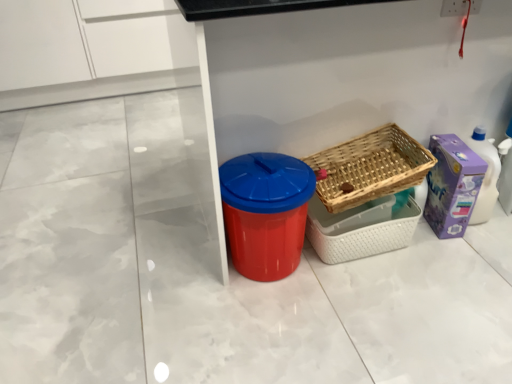
What do you see at coordinates (452, 185) in the screenshot? I see `purple cardboard box at right` at bounding box center [452, 185].

The image size is (512, 384). Describe the element at coordinates (265, 212) in the screenshot. I see `red plastic bin at center` at that location.

The width and height of the screenshot is (512, 384). What do you see at coordinates (369, 167) in the screenshot? I see `woven wood basket at center right, which appears as the 2th basket when ordered from the bottom` at bounding box center [369, 167].

What are the coordinates of `purple cardboard box at right` in the screenshot? It's located at (452, 185).

From a real-world perspective, between red plastic bin at center and purple cardboard box at right, who is vertically lower?

purple cardboard box at right, from a real-world perspective.

Which point is more distant from viewer, (305, 223) or (448, 181)?

The point (448, 181) is farther.

Can you confirm if red plastic bin at center is wider than purple cardboard box at right?

Correct, the width of red plastic bin at center exceeds that of purple cardboard box at right.

Considering the positions of objects red plastic bin at center and purple cardboard box at right in the image provided, who is in front, red plastic bin at center or purple cardboard box at right?

red plastic bin at center is closer to the camera.

Is woven wood basket at center right, which appears as the first basket when ordered from the bottom, wider or thinner than red plastic bin at center?

In the image, woven wood basket at center right, which appears as the first basket when ordered from the bottom, appears to be more narrow than red plastic bin at center.

Considering the relative sizes of woven wood basket at center right, which appears as the first basket when ordered from the bottom, and red plastic bin at center in the image provided, is woven wood basket at center right, which appears as the first basket when ordered from the bottom, taller than red plastic bin at center?

No.

Would you say woven wood basket at center right, which appears as the first basket when ordered from the bottom, is outside red plastic bin at center?

Yes.

From the picture: Is woven wood basket at center right, which appears as the first basket when ordered from the bottom, in front of or behind red plastic bin at center in the image?

In the image, woven wood basket at center right, which appears as the first basket when ordered from the bottom, appears behind red plastic bin at center.

Is woven wood basket at center right, which appears as the first basket when ordered from the bottom, completely or partially inside purple cardboard box at right?

No, woven wood basket at center right, which appears as the first basket when ordered from the bottom, is located outside of purple cardboard box at right.

Are purple cardboard box at right and woven wood basket at center right, marked as the second basket in a top-to-bottom arrangement, located far from each other?

purple cardboard box at right is actually quite close to woven wood basket at center right, marked as the second basket in a top-to-bottom arrangement.

Is purple cardboard box at right turned away from woven wood basket at center right, marked as the second basket in a top-to-bottom arrangement?

No, purple cardboard box at right is not facing away from woven wood basket at center right, marked as the second basket in a top-to-bottom arrangement.

Looking at this image, which of these two, purple cardboard box at right or woven wood basket at center right, which appears as the first basket when ordered from the bottom, is bigger?

woven wood basket at center right, which appears as the first basket when ordered from the bottom, is bigger.

Which object is thinner, purple cardboard box at right or woven wood basket at center right, the first basket in the top-to-bottom sequence?

purple cardboard box at right.

From the image's perspective, is purple cardboard box at right above or below woven wood basket at center right, which appears as the 2th basket when ordered from the bottom?

Clearly, from the image's perspective, purple cardboard box at right is below woven wood basket at center right, which appears as the 2th basket when ordered from the bottom.

Is purple cardboard box at right oriented away from woven wood basket at center right, which appears as the 2th basket when ordered from the bottom?

No, purple cardboard box at right is not facing the opposite direction of woven wood basket at center right, which appears as the 2th basket when ordered from the bottom.

Would you say purple cardboard box at right is inside or outside woven wood basket at center right, which appears as the 2th basket when ordered from the bottom?

purple cardboard box at right lies outside woven wood basket at center right, which appears as the 2th basket when ordered from the bottom.

How distant is woven wood basket at center right, which appears as the 2th basket when ordered from the bottom, from purple cardboard box at right?

woven wood basket at center right, which appears as the 2th basket when ordered from the bottom, and purple cardboard box at right are 8.38 inches apart.

Does woven wood basket at center right, which appears as the 2th basket when ordered from the bottom, appear on the left side of purple cardboard box at right?

Yes, woven wood basket at center right, which appears as the 2th basket when ordered from the bottom, is to the left of purple cardboard box at right.

Can you confirm if woven wood basket at center right, the first basket in the top-to-bottom sequence, is taller than purple cardboard box at right?

No.

From a real-world perspective, is woven wood basket at center right, the first basket in the top-to-bottom sequence, located beneath purple cardboard box at right?

Actually, woven wood basket at center right, the first basket in the top-to-bottom sequence, is physically above purple cardboard box at right in the real world.

Which object is further away from the camera taking this photo, purple cardboard box at right or red plastic bin at center?

purple cardboard box at right is more distant.

Looking at this image, can you confirm if purple cardboard box at right is shorter than red plastic bin at center?

Correct, purple cardboard box at right is not as tall as red plastic bin at center.

Which is closer to the camera, (444, 228) or (252, 211)?

Positioned in front is point (252, 211).

Between woven wood basket at center right, the first basket in the top-to-bottom sequence, and woven wood basket at center right, which appears as the first basket when ordered from the bottom, which one appears on the left side from the viewer's perspective?

From the viewer's perspective, woven wood basket at center right, the first basket in the top-to-bottom sequence, appears more on the left side.

From the image's perspective, is woven wood basket at center right, which appears as the 2th basket when ordered from the bottom, above woven wood basket at center right, which appears as the first basket when ordered from the bottom?

Correct, woven wood basket at center right, which appears as the 2th basket when ordered from the bottom, appears higher than woven wood basket at center right, which appears as the first basket when ordered from the bottom, in the image.

Identify the location of basket in front of the woven wood basket at center right, marked as the second basket in a top-to-bottom arrangement. (369, 167).

Where is `storage box below the red plastic bin at center (from a real-world perspective)`? storage box below the red plastic bin at center (from a real-world perspective) is located at coordinates (452, 185).

Find the location of a particular element. The width and height of the screenshot is (512, 384). waste container in front of the woven wood basket at center right, which appears as the first basket when ordered from the bottom is located at coordinates (265, 212).

When comparing their distances from woven wood basket at center right, which appears as the 2th basket when ordered from the bottom, does red plastic bin at center or purple cardboard box at right seem further?

red plastic bin at center is positioned further to the anchor woven wood basket at center right, which appears as the 2th basket when ordered from the bottom.

From the image, which object appears to be farther from purple cardboard box at right, woven wood basket at center right, the first basket in the top-to-bottom sequence, or woven wood basket at center right, marked as the second basket in a top-to-bottom arrangement?

woven wood basket at center right, marked as the second basket in a top-to-bottom arrangement, is further to purple cardboard box at right.

Estimate the real-world distances between objects in this image. Which object is closer to woven wood basket at center right, the first basket in the top-to-bottom sequence, purple cardboard box at right or red plastic bin at center?

Based on the image, purple cardboard box at right appears to be nearer to woven wood basket at center right, the first basket in the top-to-bottom sequence.

Which object lies nearer to the anchor point purple cardboard box at right, red plastic bin at center or woven wood basket at center right, marked as the second basket in a top-to-bottom arrangement?

Among the two, woven wood basket at center right, marked as the second basket in a top-to-bottom arrangement, is located nearer to purple cardboard box at right.

When comparing their distances from woven wood basket at center right, the first basket in the top-to-bottom sequence, does purple cardboard box at right or woven wood basket at center right, marked as the second basket in a top-to-bottom arrangement, seem closer?

woven wood basket at center right, marked as the second basket in a top-to-bottom arrangement.

Estimate the real-world distances between objects in this image. Which object is closer to red plastic bin at center, woven wood basket at center right, which appears as the first basket when ordered from the bottom, or woven wood basket at center right, the first basket in the top-to-bottom sequence?

Based on the image, woven wood basket at center right, which appears as the first basket when ordered from the bottom, appears to be nearer to red plastic bin at center.

Estimate the real-world distances between objects in this image. Which object is closer to red plastic bin at center, woven wood basket at center right, which appears as the 2th basket when ordered from the bottom, or purple cardboard box at right?

Based on the image, woven wood basket at center right, which appears as the 2th basket when ordered from the bottom, appears to be nearer to red plastic bin at center.

Based on the photo, looking at the image, which one is located further to red plastic bin at center, woven wood basket at center right, the first basket in the top-to-bottom sequence, or woven wood basket at center right, which appears as the first basket when ordered from the bottom?

woven wood basket at center right, the first basket in the top-to-bottom sequence, is further to red plastic bin at center.

You are a GUI agent. You are given a task and a screenshot of the screen. Output one action in this format:
    pyautogui.click(x=<x>, y=<y>)
    Task: Click on the basket between red plastic bin at center and woven wood basket at center right, marked as the second basket in a top-to-bottom arrangement, from left to right
    The width and height of the screenshot is (512, 384).
    Given the screenshot: What is the action you would take?
    pyautogui.click(x=369, y=167)

This screenshot has width=512, height=384. Find the location of `basket located between woven wood basket at center right, the first basket in the top-to-bottom sequence, and purple cardboard box at right in the left-right direction`. basket located between woven wood basket at center right, the first basket in the top-to-bottom sequence, and purple cardboard box at right in the left-right direction is located at coordinates (360, 229).